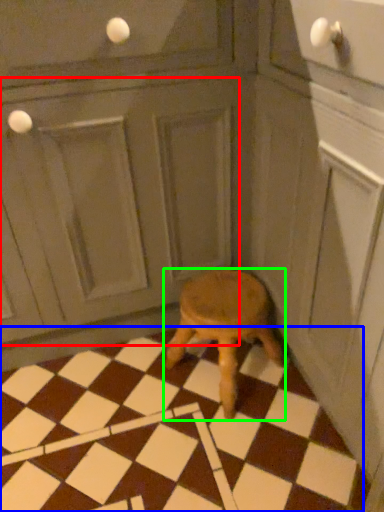
Question: Based on their relative distances, which object is nearer to screen door (highlighted by a red box)? Choose from tile (highlighted by a blue box) and stool (highlighted by a green box).

Choices:
 (A) tile
 (B) stool

Answer: (B)